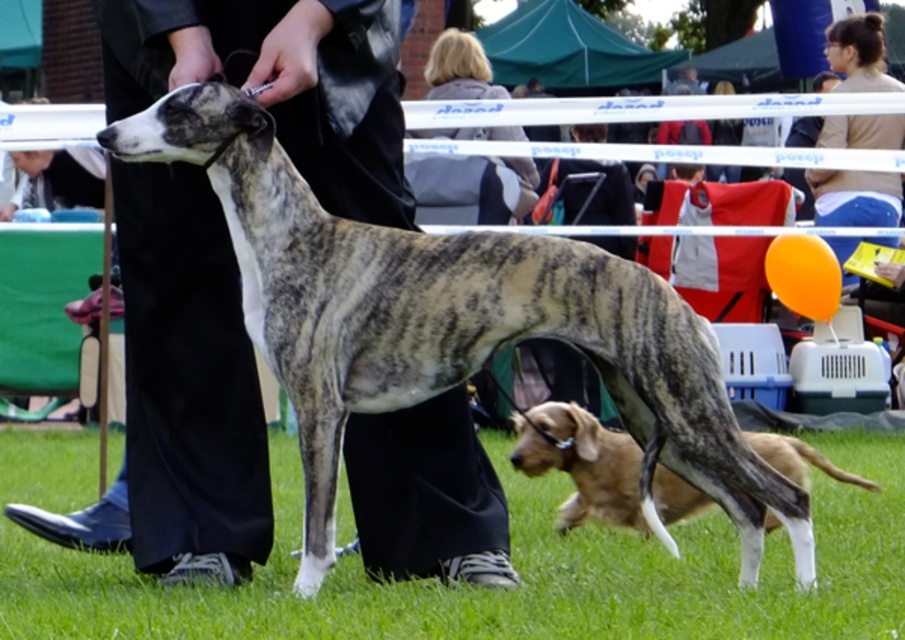
Question: Which point is closer to the camera?

Choices:
 (A) green grass at lower center
 (B) brown fur dog at lower right

Answer: (A)

Question: Which object appears closest to the camera in this image?

Choices:
 (A) speckled fur dog at center
 (B) green grass at lower center
 (C) brown leather jacket at upper right

Answer: (B)

Question: Which object is closer to the camera taking this photo?

Choices:
 (A) brown leather jacket at upper right
 (B) smooth black pants at center

Answer: (B)

Question: Is smooth black pants at center further to the viewer compared to blonde hair at upper center?

Choices:
 (A) no
 (B) yes

Answer: (A)

Question: Can you confirm if smooth black pants at center is wider than brown fur dog at lower right?

Choices:
 (A) yes
 (B) no

Answer: (A)

Question: Does smooth black pants at center appear under brown leather jacket at upper right?

Choices:
 (A) yes
 (B) no

Answer: (A)